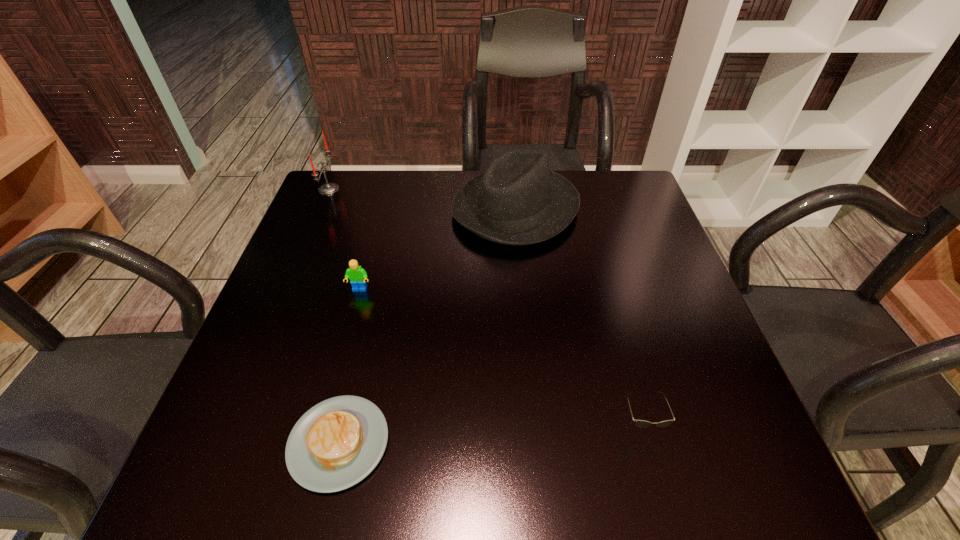
In order to click on free space at the far edge of the desktop in this screenshot , I will do `click(399, 179)`.

Find the location of a particular element. The width and height of the screenshot is (960, 540). vacant space at the near edge of the desktop is located at coordinates (517, 465).

In the image, there is a desktop. Where is `vacant space at the left edge`? vacant space at the left edge is located at coordinates (340, 276).

You are a GUI agent. You are given a task and a screenshot of the screen. Output one action in this format:
    pyautogui.click(x=<x>, y=<y>)
    Task: Click on the free spot at the right edge of the desktop
    This screenshot has width=960, height=540.
    Given the screenshot: What is the action you would take?
    pyautogui.click(x=649, y=301)

Locate an element on the screen. The height and width of the screenshot is (540, 960). vacant area at the far left corner of the desktop is located at coordinates (320, 213).

Locate an element on the screen. The height and width of the screenshot is (540, 960). free space at the far right corner of the desktop is located at coordinates (589, 204).

Find the location of a particular element. The image size is (960, 540). free space between the candle and the shortest object is located at coordinates (x=334, y=316).

Where is `free space between the third farthest object and the leftmost object`? Image resolution: width=960 pixels, height=540 pixels. free space between the third farthest object and the leftmost object is located at coordinates (345, 239).

Where is `vacant region between the third farthest object and the shortest object`? The height and width of the screenshot is (540, 960). vacant region between the third farthest object and the shortest object is located at coordinates (349, 366).

Image resolution: width=960 pixels, height=540 pixels. Identify the location of blank region between the fedora and the pancake. (427, 326).